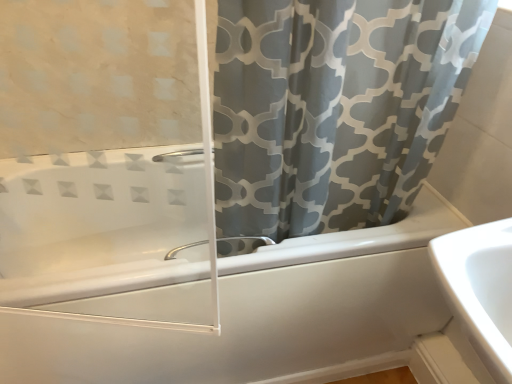
Question: Is white glossy bathtub at center in front of or behind gray fabric curtain at upper right in the image?

Choices:
 (A) front
 (B) behind

Answer: (B)

Question: Based on their sizes in the image, would you say white glossy bathtub at center is bigger or smaller than gray fabric curtain at upper right?

Choices:
 (A) small
 (B) big

Answer: (B)

Question: Which of these objects is positioned closest to the white glossy bathtub at center?

Choices:
 (A) satin nickel faucet at lower center
 (B) gray fabric curtain at upper right

Answer: (A)

Question: Based on their relative distances, which object is nearer to the satin nickel faucet at lower center?

Choices:
 (A) white glossy bathtub at center
 (B) gray fabric curtain at upper right

Answer: (A)